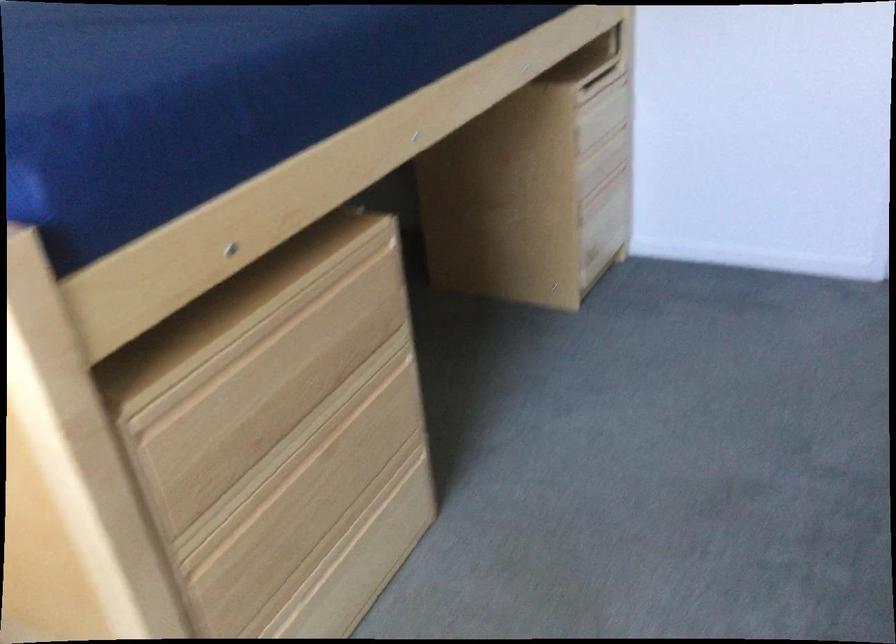
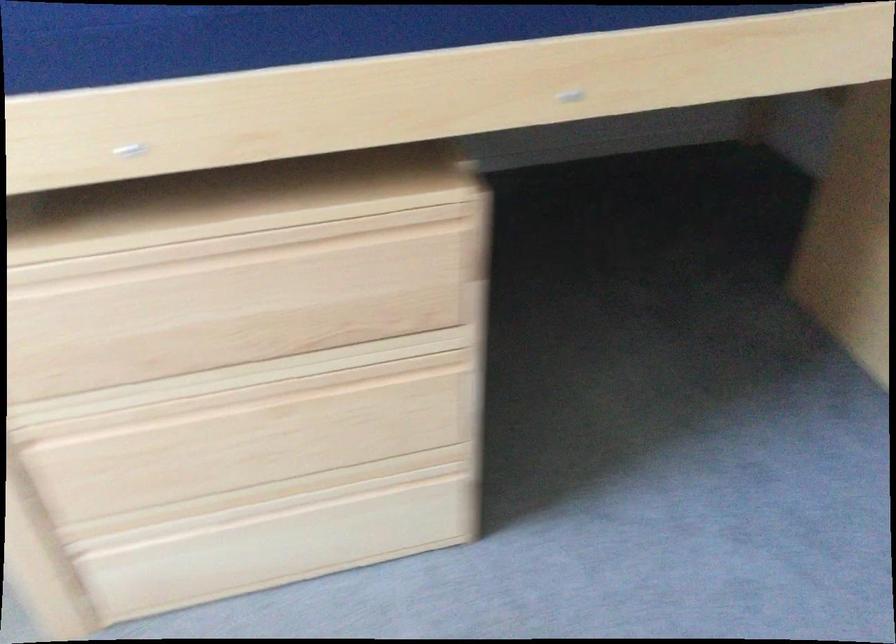
First-person continuous shooting, in which direction is the camera rotating?

The camera's rotation is toward left-down.